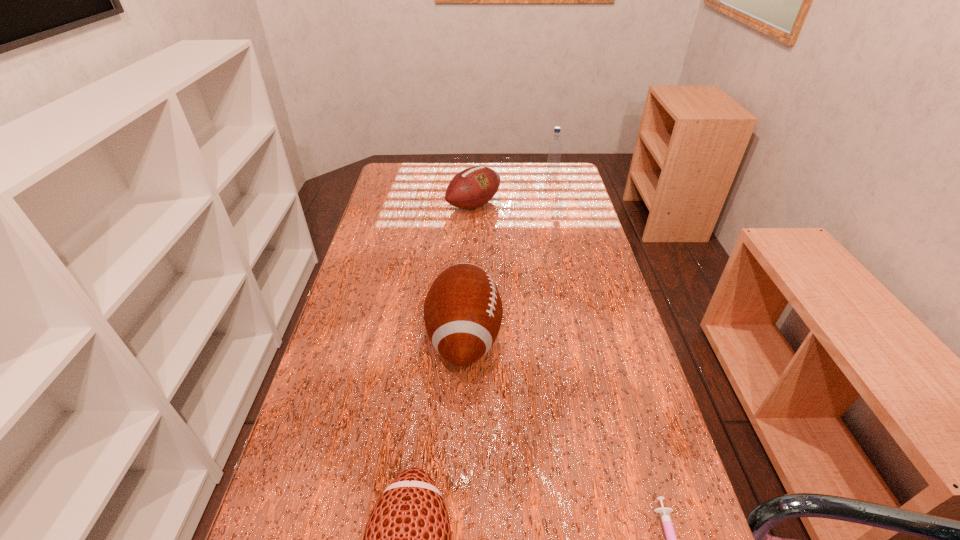
Find the location of a particular element. This screenshot has width=960, height=540. the second object from right to left is located at coordinates (555, 146).

The image size is (960, 540). I want to click on the farthest object, so click(x=555, y=146).

Find the location of a particular element. The image size is (960, 540). the tallest football is located at coordinates point(463,310).

You are a GUI agent. You are given a task and a screenshot of the screen. Output one action in this format:
    pyautogui.click(x=<x>, y=<y>)
    Task: Click on the second nearest football
    
    Given the screenshot: What is the action you would take?
    pyautogui.click(x=463, y=310)

Identify the location of the second farthest object. (473, 187).

Where is `vacant space located 0.240m on the front of the second object from right to left`? This screenshot has height=540, width=960. vacant space located 0.240m on the front of the second object from right to left is located at coordinates (562, 215).

Find the location of a particular element. This screenshot has height=540, width=960. free space located on the laces of the tallest football is located at coordinates [x=533, y=338].

The width and height of the screenshot is (960, 540). Identify the location of vacant space located on the back of the farthest football. (474, 165).

This screenshot has height=540, width=960. I want to click on water bottle at the far edge, so click(x=555, y=146).

Identify the location of football (American) at the far edge. (473, 187).